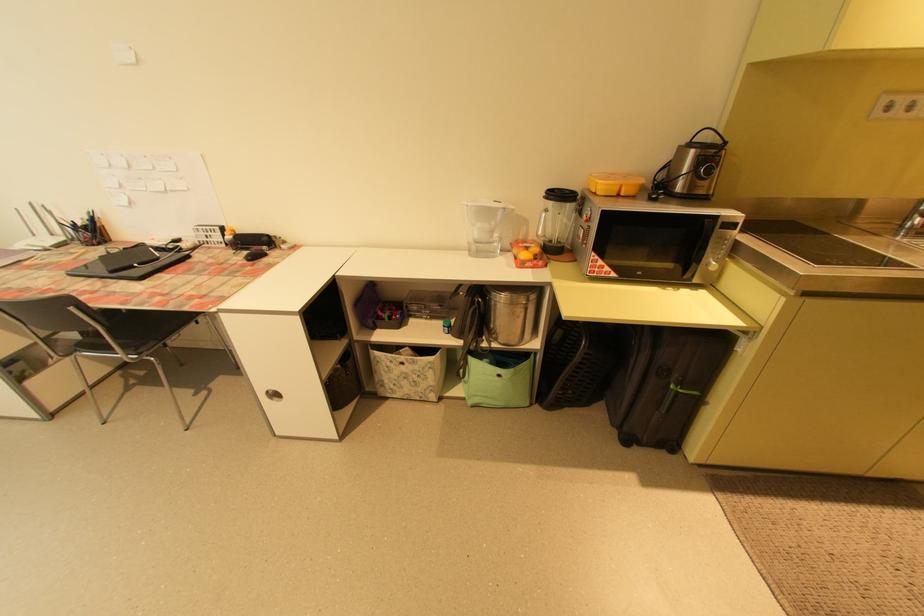
The image size is (924, 616). What do you see at coordinates (711, 270) in the screenshot?
I see `the microwave control dial` at bounding box center [711, 270].